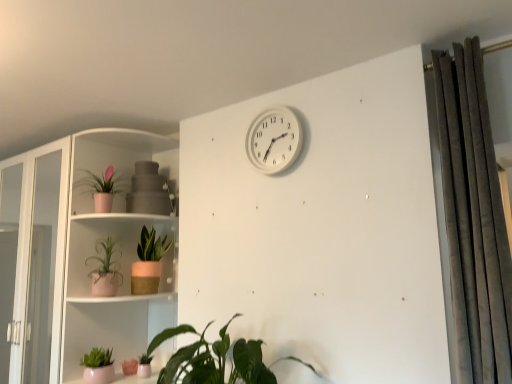
The width and height of the screenshot is (512, 384). What do you see at coordinates (144, 365) in the screenshot? I see `pink matte pot at lower left, the 2th houseplant viewed from the back` at bounding box center [144, 365].

The width and height of the screenshot is (512, 384). What do you see at coordinates (105, 269) in the screenshot?
I see `matte pink pot at left, which is the 3th houseplant in front-to-back order` at bounding box center [105, 269].

What are the coordinates of `matte pink pot at left, which is the 3th houseplant in front-to-back order` in the screenshot? It's located at (105, 269).

Image resolution: width=512 pixels, height=384 pixels. Identify the location of green matte houseplant at lower center, the first houseplant from the front. (194, 356).

What's the angular difference between matte pink pot at lower left, the fifth houseplant when ordered from back to front, and green matte houseplant at lower center, the first houseplant from the front,'s facing directions?

The angle between the facing direction of matte pink pot at lower left, the fifth houseplant when ordered from back to front, and the facing direction of green matte houseplant at lower center, the first houseplant from the front, is 22.7 degrees.

Considering the sizes of matte pink pot at lower left, the fifth houseplant when ordered from back to front, and green matte houseplant at lower center, positioned as the 6th houseplant in back-to-front order, in the image, is matte pink pot at lower left, the fifth houseplant when ordered from back to front, taller or shorter than green matte houseplant at lower center, positioned as the 6th houseplant in back-to-front order,?

In the image, matte pink pot at lower left, the fifth houseplant when ordered from back to front, appears to be shorter than green matte houseplant at lower center, positioned as the 6th houseplant in back-to-front order.

Are matte pink pot at lower left, the fifth houseplant when ordered from back to front, and green matte houseplant at lower center, positioned as the 6th houseplant in back-to-front order, making contact?

No, matte pink pot at lower left, the fifth houseplant when ordered from back to front, is not touching green matte houseplant at lower center, positioned as the 6th houseplant in back-to-front order.

Looking at their sizes, would you say matte pink pot at lower left, arranged as the 2th houseplant when viewed from the front, is wider or thinner than green matte houseplant at lower center, the first houseplant from the front?

matte pink pot at lower left, arranged as the 2th houseplant when viewed from the front, is thinner than green matte houseplant at lower center, the first houseplant from the front.

Which of these two, green matte plant pot at center-left, the 1th houseplant in the back-to-front sequence, or pink ceramic plant at left, is bigger?

pink ceramic plant at left is bigger.

Is green matte plant pot at center-left, marked as the sixth houseplant in a front-to-back arrangement, oriented towards pink ceramic plant at left?

No, green matte plant pot at center-left, marked as the sixth houseplant in a front-to-back arrangement, does not turn towards pink ceramic plant at left.

From the image's perspective, which is above, green matte plant pot at center-left, marked as the sixth houseplant in a front-to-back arrangement, or pink ceramic plant at left?

From the image's view, green matte plant pot at center-left, marked as the sixth houseplant in a front-to-back arrangement, is above.

Considering the positions of objects green matte plant pot at center-left, the 1th houseplant in the back-to-front sequence, and pink ceramic plant at left in the image provided, who is behind, green matte plant pot at center-left, the 1th houseplant in the back-to-front sequence, or pink ceramic plant at left?

green matte plant pot at center-left, the 1th houseplant in the back-to-front sequence.

From the image's perspective, which is below, matte pink pot at lower left, the fifth houseplant when ordered from back to front, or white plastic wall clock at upper center?

matte pink pot at lower left, the fifth houseplant when ordered from back to front, appears lower in the image.

Are matte pink pot at lower left, the fifth houseplant when ordered from back to front, and white plastic wall clock at upper center beside each other?

matte pink pot at lower left, the fifth houseplant when ordered from back to front, is not next to white plastic wall clock at upper center, and they're not touching.

Is matte pink pot at lower left, arranged as the 2th houseplant when viewed from the front, further to the viewer compared to white plastic wall clock at upper center?

Yes, matte pink pot at lower left, arranged as the 2th houseplant when viewed from the front, is further from the camera.

Consider the image. Does matte pink pot at lower left, the fifth houseplant when ordered from back to front, have a larger size compared to white plastic wall clock at upper center?

Incorrect, matte pink pot at lower left, the fifth houseplant when ordered from back to front, is not larger than white plastic wall clock at upper center.

Between pink ceramic plant at left and dark gray velvet curtain at right, which one has more height?

pink ceramic plant at left.

Is pink ceramic plant at left aimed at dark gray velvet curtain at right?

No, pink ceramic plant at left is not oriented towards dark gray velvet curtain at right.

Is pink ceramic plant at left at the right side of dark gray velvet curtain at right?

In fact, pink ceramic plant at left is to the left of dark gray velvet curtain at right.

Considering the relative positions of green matte plant pot at center-left, marked as the sixth houseplant in a front-to-back arrangement, and pink matte pot at lower left, the 2th houseplant viewed from the back, in the image provided, is green matte plant pot at center-left, marked as the sixth houseplant in a front-to-back arrangement, behind pink matte pot at lower left, the 2th houseplant viewed from the back,?

That is True.

What's the angular difference between green matte plant pot at center-left, marked as the sixth houseplant in a front-to-back arrangement, and pink matte pot at lower left, which is the 5th houseplant in front-to-back order,'s facing directions?

The angular difference between green matte plant pot at center-left, marked as the sixth houseplant in a front-to-back arrangement, and pink matte pot at lower left, which is the 5th houseplant in front-to-back order, is 19.8 degrees.

Visually, is green matte plant pot at center-left, marked as the sixth houseplant in a front-to-back arrangement, positioned to the left or to the right of pink matte pot at lower left, the 2th houseplant viewed from the back?

green matte plant pot at center-left, marked as the sixth houseplant in a front-to-back arrangement, is to the left of pink matte pot at lower left, the 2th houseplant viewed from the back.

What are the coordinates of `curtain in front of the matte pink pot at lower left, the fifth houseplant when ordered from back to front` in the screenshot? It's located at (473, 218).

Are matte pink pot at lower left, the fifth houseplant when ordered from back to front, and dark gray velvet curtain at right located far from each other?

Yes, matte pink pot at lower left, the fifth houseplant when ordered from back to front, and dark gray velvet curtain at right are located far from each other.

Is dark gray velvet curtain at right at the back of matte pink pot at lower left, arranged as the 2th houseplant when viewed from the front?

No, dark gray velvet curtain at right is not at the back of matte pink pot at lower left, arranged as the 2th houseplant when viewed from the front.

Between point (93, 367) and point (494, 224), which one is positioned behind?

Point (93, 367)

Does pink ceramic plant at left lie behind matte pink pot at lower left, the fifth houseplant when ordered from back to front?

No, pink ceramic plant at left is closer to the camera.

Does pink ceramic plant at left appear on the left side of matte pink pot at lower left, arranged as the 2th houseplant when viewed from the front?

Indeed, pink ceramic plant at left is positioned on the left side of matte pink pot at lower left, arranged as the 2th houseplant when viewed from the front.

Is pink ceramic plant at left far away from matte pink pot at lower left, arranged as the 2th houseplant when viewed from the front?

No, pink ceramic plant at left is not far from matte pink pot at lower left, arranged as the 2th houseplant when viewed from the front.

Locate an element on the screen. Image resolution: width=512 pixels, height=384 pixels. houseplant in front of the matte pink pot at lower left, arranged as the 2th houseplant when viewed from the front is located at coordinates (194, 356).

What are the coordinates of `the 5th houseplant behind the pink ceramic plant at left, starting your count from the anchor` in the screenshot? It's located at (148, 263).

Considering their positions, is green matte houseplant at lower center, positioned as the 6th houseplant in back-to-front order, positioned further to pink ceramic plant at left than matte pink pot at left, which is the third houseplant in back-to-front order?

green matte houseplant at lower center, positioned as the 6th houseplant in back-to-front order.

Which object lies nearer to the anchor point matte pink pot at left, which is the 4th houseplant from front to back, green matte houseplant at lower center, the first houseplant from the front, or green matte plant pot at center-left, the 1th houseplant in the back-to-front sequence?

green matte plant pot at center-left, the 1th houseplant in the back-to-front sequence, is positioned closer to the anchor matte pink pot at left, which is the 4th houseplant from front to back.

Based on their spatial positions, is matte pink pot at left, the 4th houseplant in the back-to-front sequence, or dark gray velvet curtain at right further from green matte plant pot at center-left, the 1th houseplant in the back-to-front sequence?

Based on the image, dark gray velvet curtain at right appears to be further to green matte plant pot at center-left, the 1th houseplant in the back-to-front sequence.

Looking at this image, estimate the real-world distances between objects in this image. Which object is further from matte pink pot at lower left, arranged as the 2th houseplant when viewed from the front, pink matte pot at lower left, the 2th houseplant viewed from the back, or green matte plant pot at center-left, the 1th houseplant in the back-to-front sequence?

The object further to matte pink pot at lower left, arranged as the 2th houseplant when viewed from the front, is green matte plant pot at center-left, the 1th houseplant in the back-to-front sequence.

When comparing their distances from white plastic wall clock at upper center, does pink ceramic plant at left or matte pink pot at lower left, the fifth houseplant when ordered from back to front, seem further?

matte pink pot at lower left, the fifth houseplant when ordered from back to front.

Based on their spatial positions, is dark gray velvet curtain at right or matte pink pot at left, which is the third houseplant in back-to-front order, closer to pink ceramic plant at left?

matte pink pot at left, which is the third houseplant in back-to-front order, lies closer to pink ceramic plant at left than the other object.

Which object lies further to the anchor point matte pink pot at left, which is the third houseplant in back-to-front order, green matte plant pot at center-left, the 1th houseplant in the back-to-front sequence, or matte pink pot at left, which is the 3th houseplant in front-to-back order?

Based on the image, green matte plant pot at center-left, the 1th houseplant in the back-to-front sequence, appears to be further to matte pink pot at left, which is the third houseplant in back-to-front order.

In the scene shown: Which object lies nearer to the anchor point green matte plant pot at center-left, marked as the sixth houseplant in a front-to-back arrangement, matte pink pot at lower left, the fifth houseplant when ordered from back to front, or pink ceramic plant at left?

pink ceramic plant at left.

The width and height of the screenshot is (512, 384). Find the location of `wall clock between green matte houseplant at lower center, the first houseplant from the front, and green matte plant pot at center-left, the 1th houseplant in the back-to-front sequence, along the z-axis`. wall clock between green matte houseplant at lower center, the first houseplant from the front, and green matte plant pot at center-left, the 1th houseplant in the back-to-front sequence, along the z-axis is located at coordinates (274, 140).

The height and width of the screenshot is (384, 512). I want to click on wall clock located between matte pink pot at left, which is the 4th houseplant from front to back, and dark gray velvet curtain at right in the left-right direction, so click(274, 140).

Identify the location of houseplant located between pink ceramic plant at left and matte pink pot at lower left, arranged as the 2th houseplant when viewed from the front, in the left-right direction. (102, 188).

Image resolution: width=512 pixels, height=384 pixels. I want to click on wall clock situated between pink matte pot at lower left, the 2th houseplant viewed from the back, and dark gray velvet curtain at right from left to right, so click(274, 140).